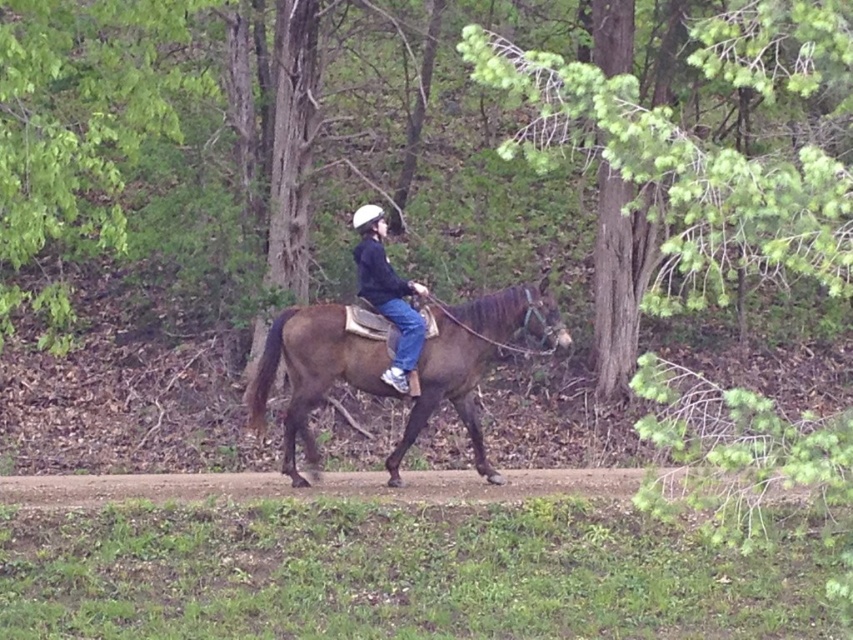
Can you confirm if green needle-like leaves at upper center is positioned to the right of brown dirt track at center?

Correct, you'll find green needle-like leaves at upper center to the right of brown dirt track at center.

Is point (636, 308) closer to camera compared to point (334, 481)?

No, (636, 308) is further to viewer.

What do you see at coordinates (666, 188) in the screenshot? This screenshot has height=640, width=853. I see `green needle-like leaves at upper center` at bounding box center [666, 188].

Find the location of a particular element. green needle-like leaves at upper center is located at coordinates (666, 188).

Is green leafy tree at center to the right of black matte jacket at center from the viewer's perspective?

No, green leafy tree at center is not to the right of black matte jacket at center.

Is green leafy tree at center further to camera compared to black matte jacket at center?

No, it is in front of black matte jacket at center.

What do you see at coordinates (694, 154) in the screenshot? The width and height of the screenshot is (853, 640). I see `green leafy tree at center` at bounding box center [694, 154].

Find the location of a particular element. This screenshot has height=640, width=853. green leafy tree at center is located at coordinates (694, 154).

Consider the image. Can you confirm if green leafy tree at center is bigger than brown dirt track at center?

Yes.

Is green leafy tree at center wider than brown dirt track at center?

Indeed, green leafy tree at center has a greater width compared to brown dirt track at center.

Does point (45, 236) come farther from viewer compared to point (86, 502)?

Yes, it is behind point (86, 502).

Where is `green leafy tree at center`? The width and height of the screenshot is (853, 640). green leafy tree at center is located at coordinates (694, 154).